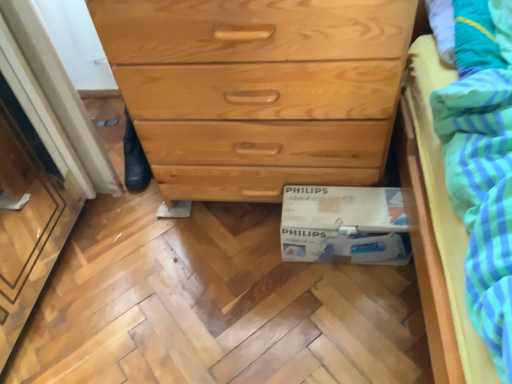
This screenshot has height=384, width=512. I want to click on vacant space that's between natural wood chest of drawers at center and white cardboard box at lower center, so click(234, 238).